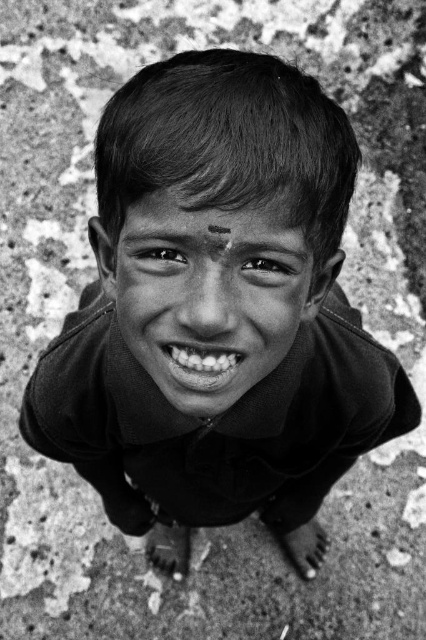
In the scene shown: Is black matte face at center above white glossy teeth at center?

Yes.

Can you confirm if black matte face at center is thinner than white glossy teeth at center?

In fact, black matte face at center might be wider than white glossy teeth at center.

Where is `black matte face at center`? Image resolution: width=426 pixels, height=640 pixels. black matte face at center is located at coordinates (209, 296).

Identify the location of black matte face at center. pyautogui.click(x=209, y=296).